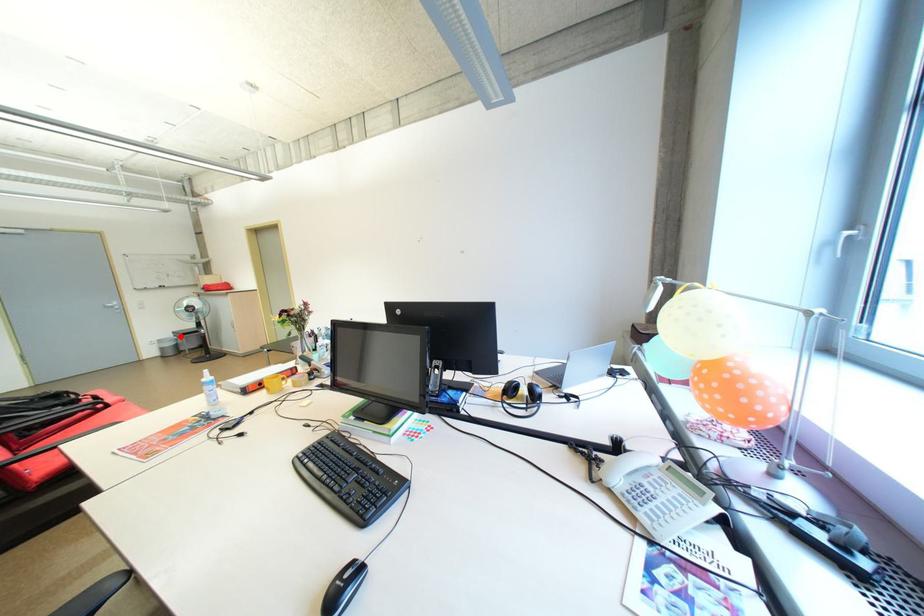
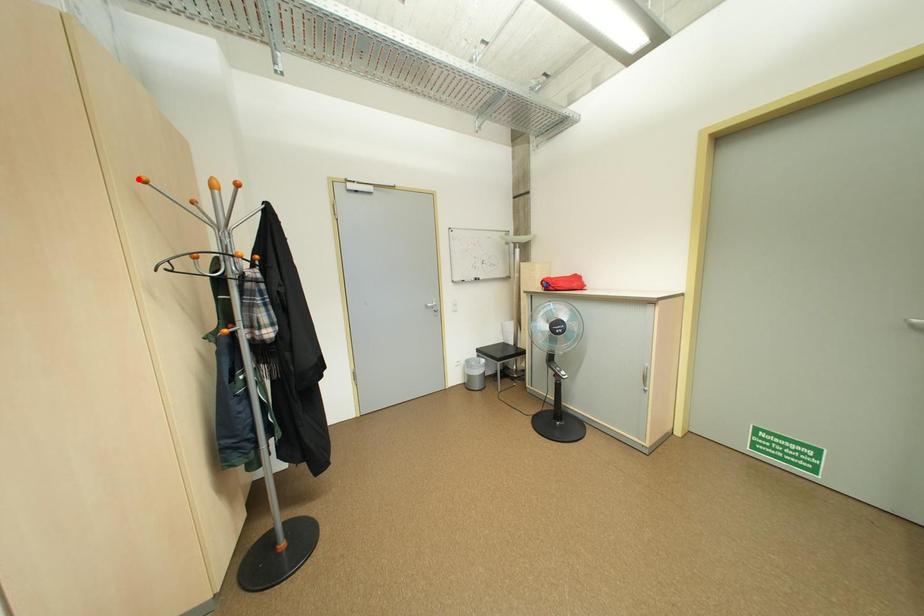
I am providing you with two images of the same scene from different viewpoints. A red point is marked on the first image and another point is marked on the second image. Is the red point in image1 aligned with the point shown in image2?

No